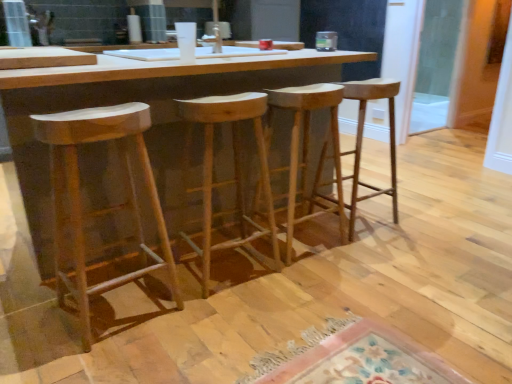
Find the location of a particular element. The width and height of the screenshot is (512, 384). vacant area that lies to the right of transparent glass door at right is located at coordinates (455, 135).